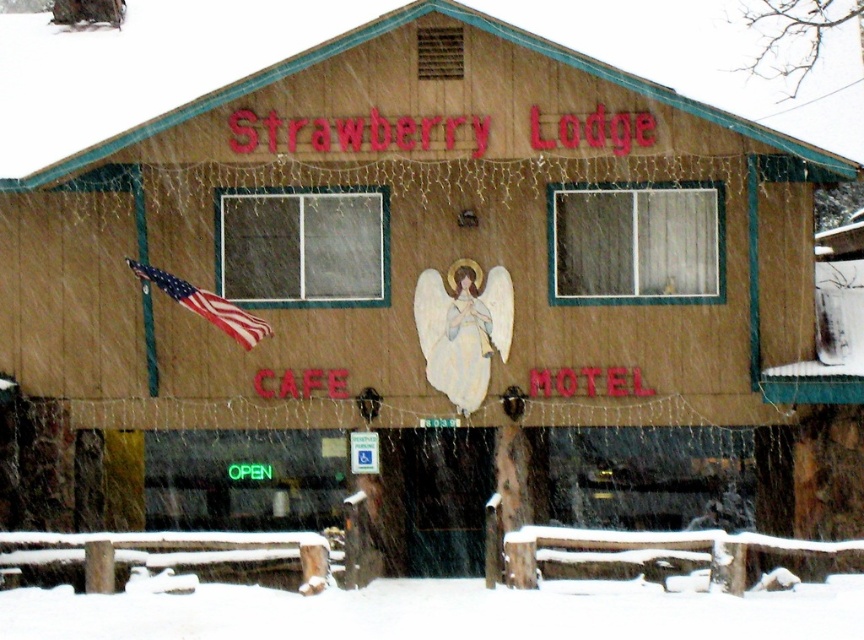
Is pastel blue fabric angel at center positioned at the back of american flag at left?

Yes, it is.

Does point (469, 291) come in front of point (138, 269)?

No.

Between point (475, 344) and point (227, 333), which one is positioned in front?

Point (227, 333)

The height and width of the screenshot is (640, 864). I want to click on pastel blue fabric angel at center, so click(462, 328).

Can you confirm if white fluffy snow at lower center is thinner than american flag at left?

No.

Does point (303, 596) lie behind point (189, 296)?

No, it is in front of (189, 296).

I want to click on white fluffy snow at lower center, so click(x=439, y=612).

Does point (10, 598) come closer to viewer compared to point (462, 369)?

Yes, it is in front of point (462, 369).

This screenshot has width=864, height=640. Describe the element at coordinates (439, 612) in the screenshot. I see `white fluffy snow at lower center` at that location.

Where is `white fluffy snow at lower center`? This screenshot has width=864, height=640. white fluffy snow at lower center is located at coordinates (439, 612).